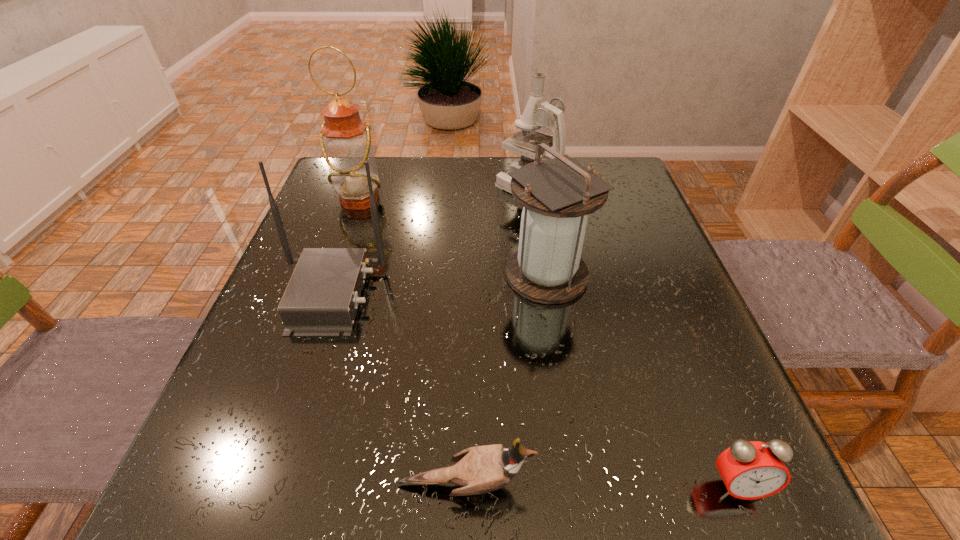
Where is `oil lamp`? The height and width of the screenshot is (540, 960). oil lamp is located at coordinates (345, 139).

Where is `microscope`? This screenshot has width=960, height=540. microscope is located at coordinates (537, 113).

At what (x,y) coordinates should I click in order to perform the action: click on lantern. Please return your answer as a coordinate pair (x, y). Looking at the image, I should click on (558, 194).

Locate an element on the screen. router is located at coordinates (322, 297).

Find the location of a particular element. bird is located at coordinates (482, 469).

Find the location of a particular element. alarm clock is located at coordinates (750, 470).

This screenshot has height=540, width=960. In order to click on the shortest object in this screenshot , I will do `click(750, 470)`.

I want to click on vacant space located 0.370m on the front of the tallest object, so click(x=316, y=327).

At what (x,y) coordinates should I click in order to perform the action: click on free location located on the back of the microscope. Please return your answer as a coordinate pair (x, y). The height and width of the screenshot is (540, 960). Looking at the image, I should click on (525, 160).

The height and width of the screenshot is (540, 960). In order to click on free location located on the left of the lantern in this screenshot , I will do `click(333, 275)`.